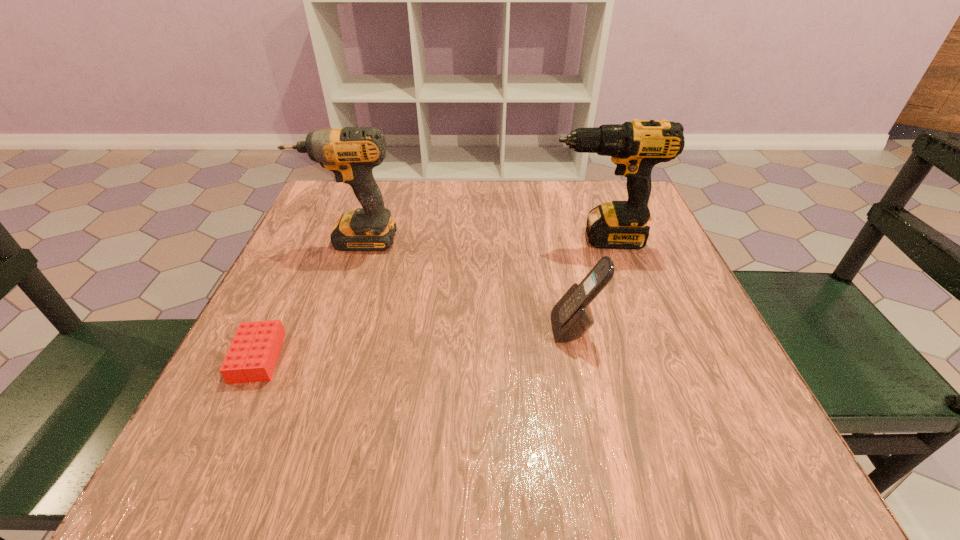
Identify the location of vacant area between the Lego and the third tallest object. (417, 343).

The width and height of the screenshot is (960, 540). Find the location of `free space between the second shortest object and the left drill`. free space between the second shortest object and the left drill is located at coordinates (464, 284).

The height and width of the screenshot is (540, 960). What are the coordinates of `vacant area that lies between the Lego and the third tallest object` in the screenshot? It's located at 417,343.

I want to click on object identified as the third closest to the left drill, so click(571, 317).

The image size is (960, 540). I want to click on the closest object to the right drill, so click(571, 317).

What are the coordinates of `free space that satisfies the following two spatial constraints: 1. at the tip of the right drill; 2. on the front side of the shortest object` in the screenshot? It's located at (640, 357).